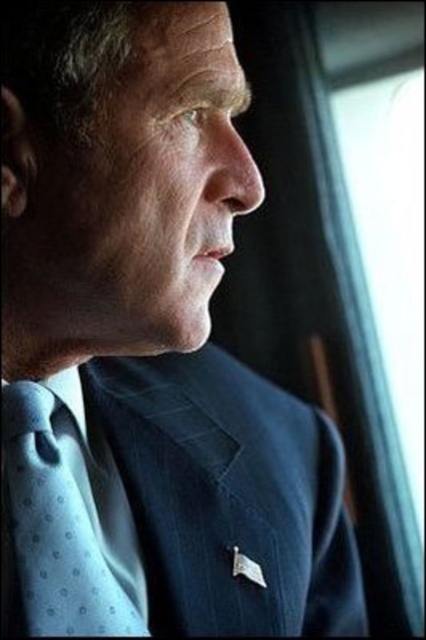
Is point (203, 349) closer to camera compared to point (115, 566)?

No, (203, 349) is further to viewer.

Between point (178, 424) and point (106, 541), which one is positioned behind?

Positioned behind is point (178, 424).

Is point (331, 627) closer to camera compared to point (86, 467)?

No, it is not.

Image resolution: width=426 pixels, height=640 pixels. What are the coordinates of `dark blue textured suit at center` in the screenshot? It's located at (230, 497).